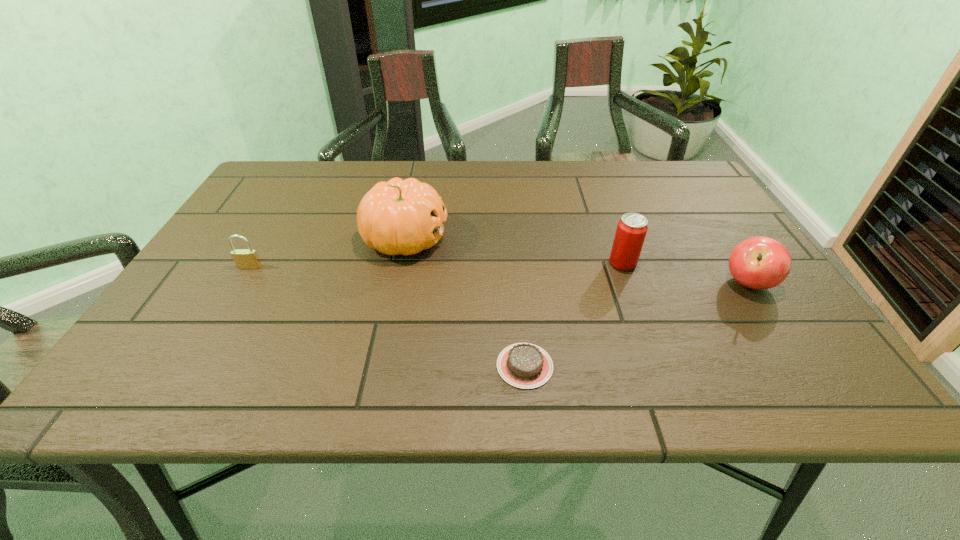
Find the location of a particular element. The height and width of the screenshot is (540, 960). object that is the closest to the rightmost object is located at coordinates (631, 230).

You are a GUI agent. You are given a task and a screenshot of the screen. Output one action in this format:
    pyautogui.click(x=<x>, y=<y>)
    Task: Click on the object that stands as the closest to the padlock
    The height and width of the screenshot is (540, 960).
    Given the screenshot: What is the action you would take?
    pyautogui.click(x=404, y=217)

Locate an element on the screen. The width and height of the screenshot is (960, 540). vacant position in the image that satisfies the following two spatial constraints: 1. on the front side of the apple; 2. on the left side of the can is located at coordinates (631, 284).

Where is `blank space that satisfies the following two spatial constraints: 1. on the front-facing side of the leftmost object; 2. on the right side of the shortest object`? The height and width of the screenshot is (540, 960). blank space that satisfies the following two spatial constraints: 1. on the front-facing side of the leftmost object; 2. on the right side of the shortest object is located at coordinates (191, 366).

Where is `vacant space that satisfies the following two spatial constraints: 1. on the carved face of the second object from left to right; 2. on the front-facing side of the second shortest object`? vacant space that satisfies the following two spatial constraints: 1. on the carved face of the second object from left to right; 2. on the front-facing side of the second shortest object is located at coordinates (399, 267).

In order to click on vacant region that satisfies the following two spatial constraints: 1. on the carved face of the rightmost object; 2. on the left side of the fourth object from right to left in this screenshot , I will do `click(396, 284)`.

At what (x,y) coordinates should I click in order to perform the action: click on free spot that satisfies the following two spatial constraints: 1. on the carved face of the tallest object; 2. on the front-facing side of the leftmost object. Please return your answer as a coordinate pair (x, y). The height and width of the screenshot is (540, 960). Looking at the image, I should click on (399, 267).

This screenshot has height=540, width=960. Find the location of `vacant space that satisfies the following two spatial constraints: 1. on the carved face of the second object from right to left; 2. on the left side of the tallest object`. vacant space that satisfies the following two spatial constraints: 1. on the carved face of the second object from right to left; 2. on the left side of the tallest object is located at coordinates (400, 263).